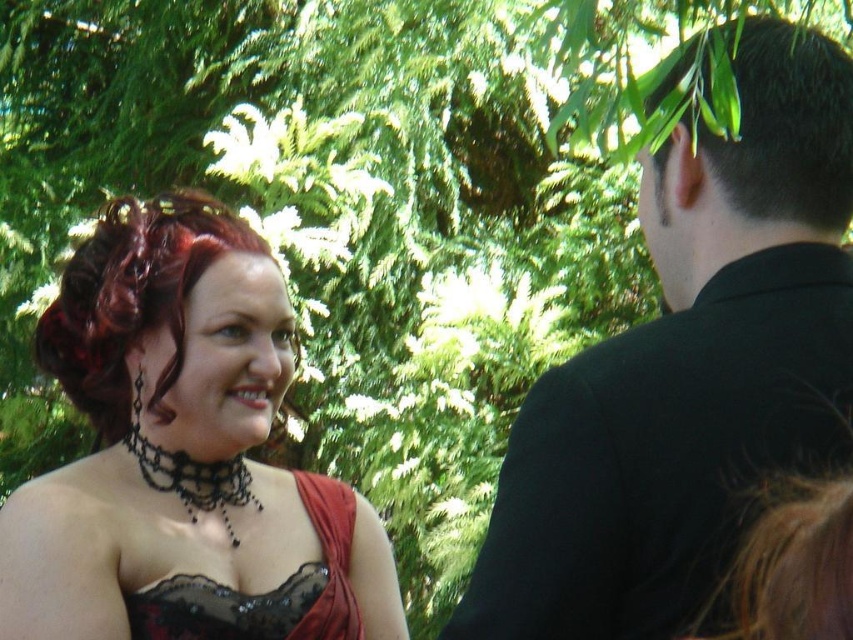
Question: In this image, where is lace fabric dress at left located relative to dark brown hair at upper right?

Choices:
 (A) above
 (B) below

Answer: (B)

Question: From the image, what is the correct spatial relationship of dark red curly hair at left in relation to dark brown hair at upper right?

Choices:
 (A) above
 (B) below

Answer: (B)

Question: Does black matte suit at upper right appear on the right side of dark brown hair at upper right?

Choices:
 (A) yes
 (B) no

Answer: (B)

Question: Which point is farther to the camera?

Choices:
 (A) lace fabric dress at left
 (B) black lace dress at center

Answer: (B)

Question: Which point appears farthest from the camera in this image?

Choices:
 (A) (693, 317)
 (B) (109, 300)
 (C) (735, 84)
 (D) (193, 212)

Answer: (D)

Question: Among these objects, which one is nearest to the camera?

Choices:
 (A) dark red curly hair at left
 (B) dark brown hair at upper right
 (C) black matte suit at upper right

Answer: (C)